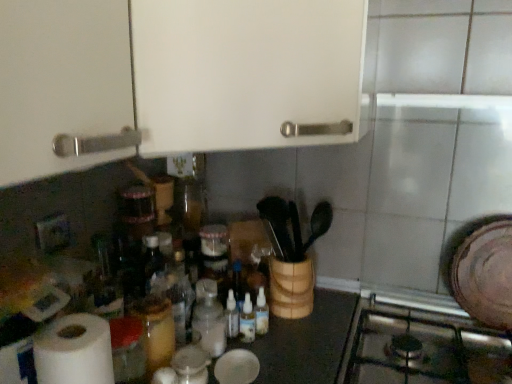
The height and width of the screenshot is (384, 512). Find the location of `stainless steel gas stove at lower right`. stainless steel gas stove at lower right is located at coordinates (423, 348).

Measure the distance between translucent glass jar at center, positioned as the fourth bottle in right-to-left order, and camera.

They are 30.71 inches apart.

What is the approximate height of translucent plastic bottles at center, which appears as the 2th bottle when viewed from the right?

translucent plastic bottles at center, which appears as the 2th bottle when viewed from the right, is 4.67 inches in height.

Image resolution: width=512 pixels, height=384 pixels. Describe the element at coordinates (74, 351) in the screenshot. I see `white matte paper towel at lower left` at that location.

Find the location of `translucent plastic bottle at center, the second bottle in the left-to-right sequence`. translucent plastic bottle at center, the second bottle in the left-to-right sequence is located at coordinates (209, 319).

This screenshot has height=384, width=512. What are the coordinates of `bottle that is the 3rd object to the right of the white matte paper towel at lower left, starting at the anchor` in the screenshot? It's located at (247, 320).

From a real-world perspective, is white matte paper towel at lower left over translucent plastic bottles at center, arranged as the third bottle when viewed from the left?

Yes, from a real-world perspective, white matte paper towel at lower left is over translucent plastic bottles at center, arranged as the third bottle when viewed from the left

Which of these two, white matte paper towel at lower left or translucent plastic bottles at center, arranged as the third bottle when viewed from the left, stands taller?

Standing taller between the two is white matte paper towel at lower left.

From the image's perspective, which object appears higher, white matte paper towel at lower left or translucent plastic bottles at center, arranged as the third bottle when viewed from the left?

translucent plastic bottles at center, arranged as the third bottle when viewed from the left, is shown above in the image.

Between translucent plastic bottles at center, arranged as the first bottle when viewed from the right, and white matte paper towel at lower left, which one appears on the right side from the viewer's perspective?

translucent plastic bottles at center, arranged as the first bottle when viewed from the right, is more to the right.

Who is smaller, translucent plastic bottles at center, arranged as the first bottle when viewed from the right, or white matte paper towel at lower left?

translucent plastic bottles at center, arranged as the first bottle when viewed from the right.

Does translucent plastic bottles at center, which ranks as the 4th bottle in left-to-right order, have a greater height compared to white matte paper towel at lower left?

No, translucent plastic bottles at center, which ranks as the 4th bottle in left-to-right order, is not taller than white matte paper towel at lower left.

Can you confirm if translucent plastic bottles at center, which appears as the 2th bottle when viewed from the right, is shorter than translucent plastic bottle at center, which is the third bottle from right to left?

Yes.

How distant is translucent plastic bottles at center, which appears as the 2th bottle when viewed from the right, from translucent plastic bottle at center, the second bottle in the left-to-right sequence?

They are 3.05 inches apart.

Starting from the translucent plastic bottles at center, arranged as the third bottle when viewed from the left, which bottle is the 1st one in front? Please provide its 2D coordinates.

[(209, 319)]

Which object is positioned more to the right, translucent plastic bottles at center, arranged as the third bottle when viewed from the left, or translucent plastic bottle at center, the second bottle in the left-to-right sequence?

translucent plastic bottles at center, arranged as the third bottle when viewed from the left, is more to the right.

Considering the positions of objects translucent plastic bottle at center, the second bottle in the left-to-right sequence, and translucent plastic bottles at center, which ranks as the 4th bottle in left-to-right order, in the image provided, who is behind, translucent plastic bottle at center, the second bottle in the left-to-right sequence, or translucent plastic bottles at center, which ranks as the 4th bottle in left-to-right order,?

translucent plastic bottles at center, which ranks as the 4th bottle in left-to-right order, is more distant.

From a real-world perspective, starting from the translucent plastic bottles at center, which ranks as the 4th bottle in left-to-right order, which bottle is the 2nd one vertically above it? Please provide its 2D coordinates.

[(209, 319)]

Is translucent plastic bottle at center, which is the third bottle from right to left, surrounding translucent plastic bottles at center, arranged as the first bottle when viewed from the right?

No, translucent plastic bottles at center, arranged as the first bottle when viewed from the right, is not inside translucent plastic bottle at center, which is the third bottle from right to left.

From a real-world perspective, relative to translucent plastic bottle at center, which is the third bottle from right to left, is translucent glass jar at center, arranged as the 1th bottle when viewed from the left, vertically above or below?

In terms of real-world spatial position, translucent glass jar at center, arranged as the 1th bottle when viewed from the left, is above translucent plastic bottle at center, which is the third bottle from right to left.

Is the position of translucent glass jar at center, arranged as the 1th bottle when viewed from the left, more distant than that of translucent plastic bottle at center, which is the third bottle from right to left?

No.

Considering the sizes of objects translucent glass jar at center, positioned as the fourth bottle in right-to-left order, and translucent plastic bottle at center, the second bottle in the left-to-right sequence, in the image provided, who is taller, translucent glass jar at center, positioned as the fourth bottle in right-to-left order, or translucent plastic bottle at center, the second bottle in the left-to-right sequence,?

Standing taller between the two is translucent plastic bottle at center, the second bottle in the left-to-right sequence.

Is translucent glass jar at center, positioned as the fourth bottle in right-to-left order, not inside translucent plastic bottle at center, the second bottle in the left-to-right sequence?

Yes.

Is point (366, 361) farther from camera compared to point (340, 110)?

Yes, it is behind point (340, 110).

Which object is closer to the camera, stainless steel gas stove at lower right or white matte cabinet at upper center?

white matte cabinet at upper center is closer to the camera.

Is stainless steel gas stove at lower right surrounding white matte cabinet at upper center?

No, white matte cabinet at upper center is not surrounded by stainless steel gas stove at lower right.

Based on their positions, is stainless steel gas stove at lower right located to the left or right of white matte cabinet at upper center?

stainless steel gas stove at lower right is to the right of white matte cabinet at upper center.

Consider the image. Which object is more forward, stainless steel gas stove at lower right or translucent plastic bottles at center, arranged as the first bottle when viewed from the right?

stainless steel gas stove at lower right.

Considering the relative sizes of stainless steel gas stove at lower right and translucent plastic bottles at center, which ranks as the 4th bottle in left-to-right order, in the image provided, is stainless steel gas stove at lower right shorter than translucent plastic bottles at center, which ranks as the 4th bottle in left-to-right order,?

In fact, stainless steel gas stove at lower right may be taller than translucent plastic bottles at center, which ranks as the 4th bottle in left-to-right order.

Is stainless steel gas stove at lower right positioned beyond the bounds of translucent plastic bottles at center, arranged as the first bottle when viewed from the right?

Yes.

Is stainless steel gas stove at lower right not near translucent plastic bottles at center, arranged as the first bottle when viewed from the right?

No, there isn't a large distance between stainless steel gas stove at lower right and translucent plastic bottles at center, arranged as the first bottle when viewed from the right.

Find the location of `the 1st bottle positioned above the white matte paper towel at lower left (from the image's perspective)`. the 1st bottle positioned above the white matte paper towel at lower left (from the image's perspective) is located at coordinates (247, 320).

At what (x,y) coordinates should I click in order to perform the action: click on paper towel lying below the translucent plastic bottles at center, which ranks as the 4th bottle in left-to-right order (from the image's perspective). Please return your answer as a coordinate pair (x, y). Looking at the image, I should click on (74, 351).

Based on their spatial positions, is translucent plastic bottles at center, arranged as the first bottle when viewed from the right, or white matte cabinet at upper center further from translucent plastic bottles at center, which appears as the 2th bottle when viewed from the right?

white matte cabinet at upper center is positioned further to the anchor translucent plastic bottles at center, which appears as the 2th bottle when viewed from the right.

Estimate the real-world distances between objects in this image. Which object is closer to translucent plastic bottles at center, arranged as the third bottle when viewed from the left, translucent plastic bottle at center, which is the third bottle from right to left, or translucent plastic bottles at center, arranged as the first bottle when viewed from the right?

translucent plastic bottles at center, arranged as the first bottle when viewed from the right, is positioned closer to the anchor translucent plastic bottles at center, arranged as the third bottle when viewed from the left.

Looking at the image, which one is located further to stainless steel gas stove at lower right, translucent plastic bottle at center, which is the third bottle from right to left, or translucent glass jar at center, arranged as the 1th bottle when viewed from the left?

Based on the image, translucent glass jar at center, arranged as the 1th bottle when viewed from the left, appears to be further to stainless steel gas stove at lower right.

Which object lies further to the anchor point white matte paper towel at lower left, translucent plastic bottles at center, which ranks as the 4th bottle in left-to-right order, or stainless steel gas stove at lower right?

stainless steel gas stove at lower right.

Which object lies further to the anchor point translucent plastic bottles at center, arranged as the first bottle when viewed from the right, translucent plastic bottle at center, which is the third bottle from right to left, or stainless steel gas stove at lower right?

stainless steel gas stove at lower right.

Estimate the real-world distances between objects in this image. Which object is further from white matte paper towel at lower left, translucent plastic bottles at center, which appears as the 2th bottle when viewed from the right, or translucent plastic bottles at center, arranged as the first bottle when viewed from the right?

translucent plastic bottles at center, arranged as the first bottle when viewed from the right.

Estimate the real-world distances between objects in this image. Which object is closer to white matte paper towel at lower left, translucent glass jar at center, arranged as the 1th bottle when viewed from the left, or translucent plastic bottles at center, which ranks as the 4th bottle in left-to-right order?

translucent glass jar at center, arranged as the 1th bottle when viewed from the left, is closer to white matte paper towel at lower left.

Considering their positions, is translucent plastic bottles at center, which appears as the 2th bottle when viewed from the right, positioned closer to translucent glass jar at center, positioned as the fourth bottle in right-to-left order, than white matte paper towel at lower left?

The object closer to translucent glass jar at center, positioned as the fourth bottle in right-to-left order, is white matte paper towel at lower left.

Where is `bottle situated between translucent plastic bottle at center, the second bottle in the left-to-right sequence, and translucent plastic bottles at center, arranged as the first bottle when viewed from the right, from left to right`? This screenshot has height=384, width=512. bottle situated between translucent plastic bottle at center, the second bottle in the left-to-right sequence, and translucent plastic bottles at center, arranged as the first bottle when viewed from the right, from left to right is located at coordinates (247, 320).

This screenshot has height=384, width=512. Find the location of `bottle between white matte paper towel at lower left and translucent plastic bottle at center, which is the third bottle from right to left, from front to back`. bottle between white matte paper towel at lower left and translucent plastic bottle at center, which is the third bottle from right to left, from front to back is located at coordinates (156, 330).

Find the location of a particular element. The image size is (512, 384). bottle situated between translucent glass jar at center, positioned as the fourth bottle in right-to-left order, and translucent plastic bottles at center, arranged as the third bottle when viewed from the left, from left to right is located at coordinates (209, 319).

Locate an element on the screen. The image size is (512, 384). bottle between white matte cabinet at upper center and translucent plastic bottles at center, which ranks as the 4th bottle in left-to-right order, in the up-down direction is located at coordinates point(209,319).